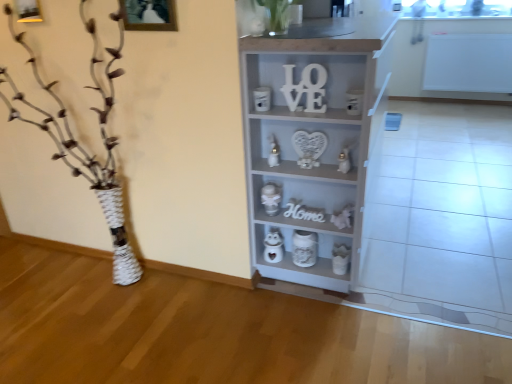
Question: Considering the positions of metallic silver toy at center, the third toy viewed from the top, and white wooden letter at upper center, which appears as the second letter when ordered from the bottom, in the image, is metallic silver toy at center, the third toy viewed from the top, bigger or smaller than white wooden letter at upper center, which appears as the second letter when ordered from the bottom,?

Choices:
 (A) small
 (B) big

Answer: (B)

Question: Is metallic silver toy at center, placed as the fourth toy when sorted from bottom to top, spatially inside white wooden letter at upper center, positioned as the first letter in top-to-bottom order, or outside of it?

Choices:
 (A) outside
 (B) inside

Answer: (A)

Question: Which object is positioned closest to the wooden picture frame at upper center?

Choices:
 (A) metallic silver toy at center, the third toy viewed from the top
 (B) white glossy candle at center, arranged as the 1th toy when viewed from the top
 (C) white wood letter at center, which is the 1th letter in back-to-front order
 (D) white painted wood shelf at center
 (E) white glossy heart at center, which appears as the fifth toy when viewed from the top

Answer: (B)

Question: Based on their relative distances, which object is nearer to the white glossy heart at center, the second toy from the bottom?

Choices:
 (A) white wooden letter at upper center, which appears as the second letter when ordered from the bottom
 (B) white wood letter at center, which ranks as the 1th letter in bottom-to-top order
 (C) white textured vase at left
 (D) white painted wood shelf at center
 (E) white matte cat at lower center, the 3th toy from the bottom

Answer: (B)